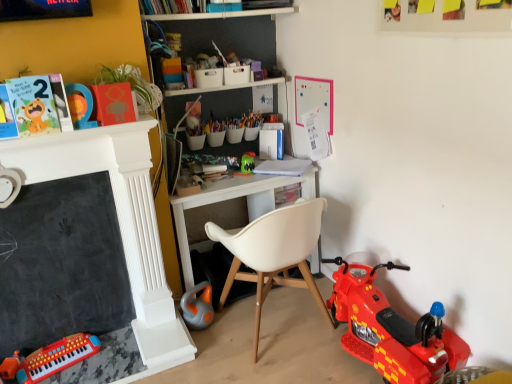
The image size is (512, 384). Find the location of `vacant space underneath white matte chair at center (from a real-world perspective)`. vacant space underneath white matte chair at center (from a real-world perspective) is located at coordinates (285, 328).